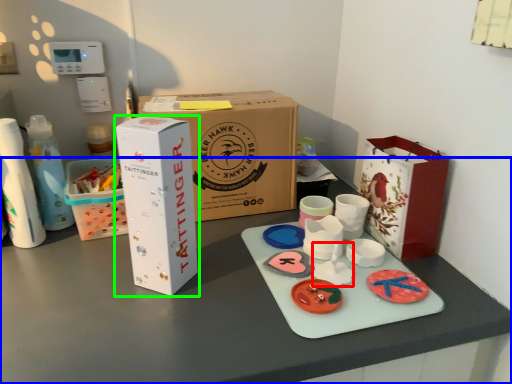
Question: Estimate the real-world distances between objects in this image. Which object is closer to toy (highlighted by a red box), table (highlighted by a blue box) or box (highlighted by a green box)?

Choices:
 (A) table
 (B) box

Answer: (A)